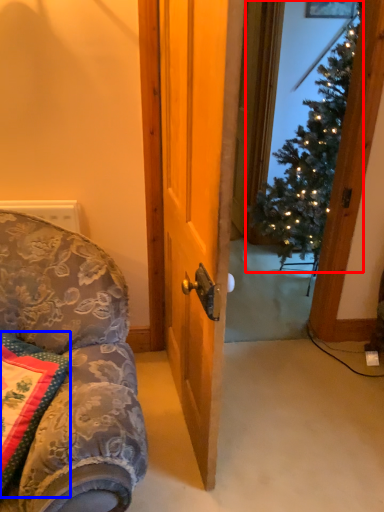
Question: Which point is closer to the camera, christmas tree (highlighted by a red box) or pillow (highlighted by a blue box)?

Choices:
 (A) christmas tree
 (B) pillow

Answer: (B)